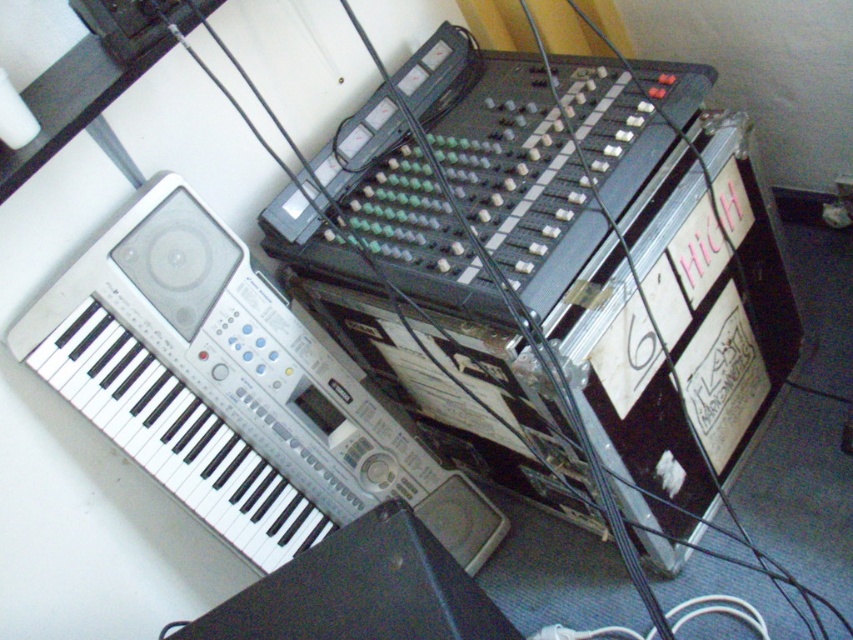
You are setting up a sound system and need to place the metallic gray mixer at center and the black plastic speaker at lower left. According to the image, which one is located to the right of the other?

The metallic gray mixer at center is positioned on the right side of black plastic speaker at lower left, so the metallic gray mixer at center is to the right of the black plastic speaker at lower left.

You are a sound engineer setting up equipment for a live performance. You need to position the white plastic keyboard at upper left and the black plastic speaker at lower left so that the keyboard is to the left of the speaker. Is the current arrangement correct?

Yes, the current arrangement is correct because the white plastic keyboard at upper left is already positioned to the left of the black plastic speaker at lower left as described in the objects description.

You are a sound engineer setting up equipment for a live performance. You need to place a new microphone stand between the keyboard synthesizer and the mixer located at point (558,272). Can you fit it there without blocking the mixer?

The mixer at point (558,272) is located at center, so placing the microphone stand between the keyboard synthesizer and the mixer at center should be possible as long as there is enough space between them. However, ensure that the stand does not obstruct the mixer controls.